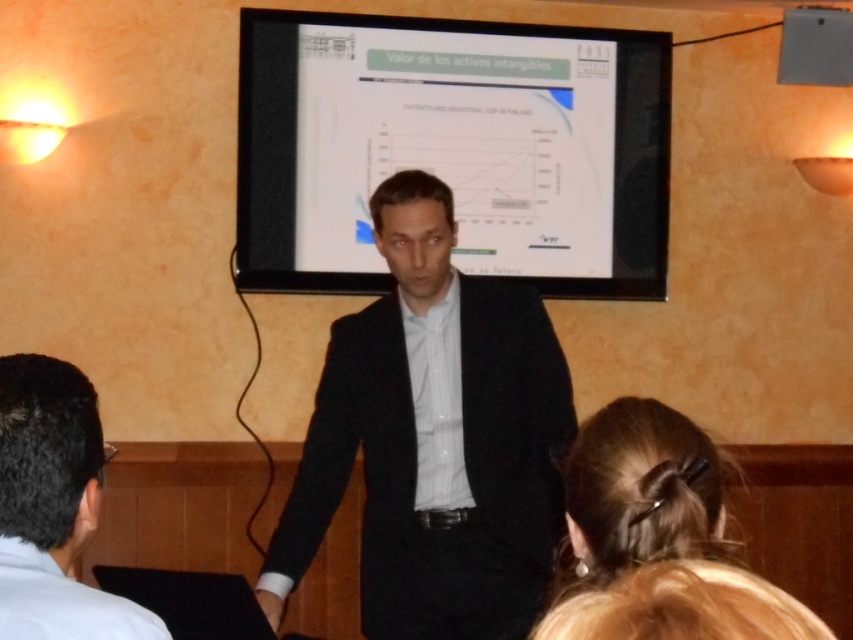
Question: Which point is closer to the camera?

Choices:
 (A) blonde hair at lower right
 (B) black wool suit at center
 (C) matte black laptop at upper center

Answer: (A)

Question: Can you confirm if black wool suit at center is wider than blonde hair at lower right?

Choices:
 (A) yes
 (B) no

Answer: (A)

Question: Does matte black screen at center have a smaller size compared to black wool suit at center?

Choices:
 (A) yes
 (B) no

Answer: (B)

Question: Which of the following is the closest to the observer?

Choices:
 (A) blonde hair at lower right
 (B) matte black laptop at upper center

Answer: (A)

Question: Considering the relative positions of light blue shirt at lower left and matte black laptop at upper center in the image provided, where is light blue shirt at lower left located with respect to matte black laptop at upper center?

Choices:
 (A) right
 (B) left

Answer: (B)

Question: Based on their relative distances, which object is farther from the matte black laptop at upper center?

Choices:
 (A) light blue shirt at lower left
 (B) black wool suit at center

Answer: (A)